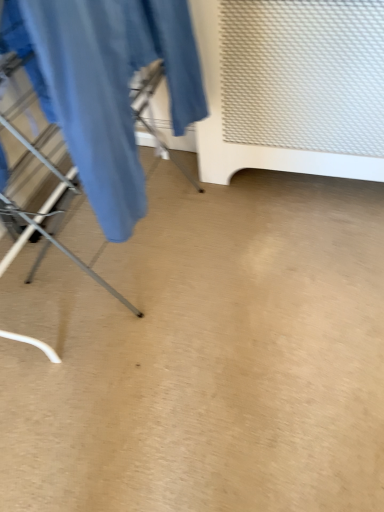
Find the location of a particular element. The width and height of the screenshot is (384, 512). vacant area that lies in front of white textured radiator at upper right is located at coordinates (296, 253).